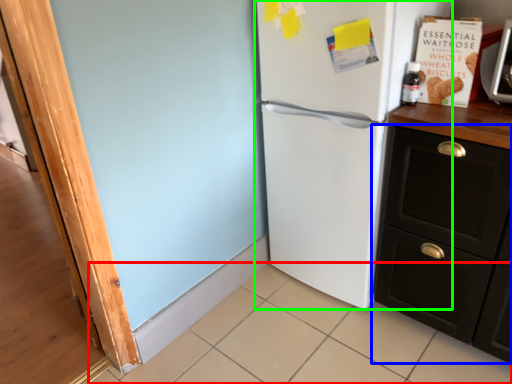
Question: Based on their relative distances, which object is nearer to tile (highlighted by a red box)? Choose from cabinetry (highlighted by a blue box) and refrigerator (highlighted by a green box).

Choices:
 (A) cabinetry
 (B) refrigerator

Answer: (A)